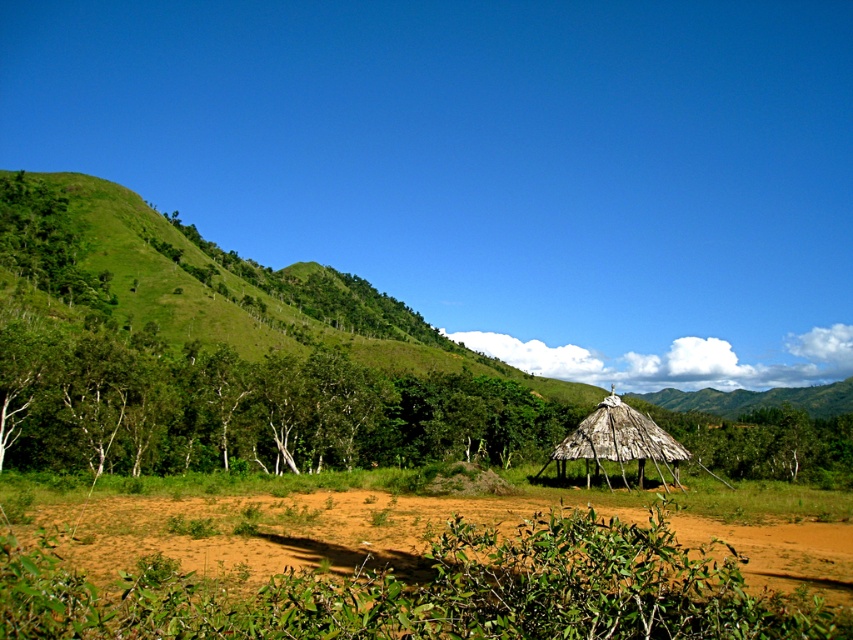
In the scene shown: You are standing at the edge of the reddish brown earth area and want to reach the natural thatch hut at center. Which direction should you move relative to the brown sandy soil at lower center?

To reach the natural thath hut at center from the brown sandy soil at lower center, you should move to the right since the brown sandy soil at lower center is located to the left of the natural thath hut at center.

You are planning to build a small garden between the green leafy trees at left and the natural thatch hut at center. Which object will provide more shade for your garden?

The green leafy trees at left will provide more shade for your garden because they are larger in size than the natural thatch hut at center.

You are a delivery drone with a maximum flight altitude of 10 meters. You need to deliver a package to the natural thatch hut at center. The brown sandy soil at lower center is your current location. Can you fly directly to the hut without exceeding your altitude limit?

The distance between the brown sandy soil at lower center and the natural thatch hut at center is 9.37 meters. Since the drone can fly up to 10 meters, it can safely reach the hut without exceeding its altitude limit.